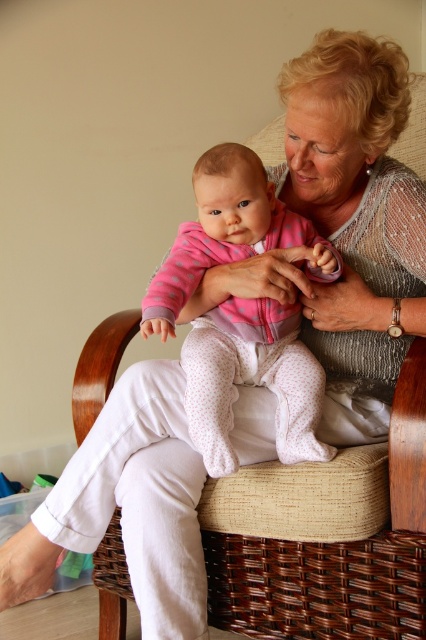
Question: Considering the relative positions of woven brown chair at center and pink fleece onesie at center in the image provided, where is woven brown chair at center located with respect to pink fleece onesie at center?

Choices:
 (A) below
 (B) above

Answer: (A)

Question: Considering the relative positions of woven brown chair at center and pink fleece onesie at center in the image provided, where is woven brown chair at center located with respect to pink fleece onesie at center?

Choices:
 (A) above
 (B) below

Answer: (B)

Question: Which point is farther to the camera?

Choices:
 (A) (313, 252)
 (B) (229, 561)

Answer: (B)

Question: Can you confirm if woven brown chair at center is positioned below pink fleece onesie at center?

Choices:
 (A) no
 (B) yes

Answer: (B)